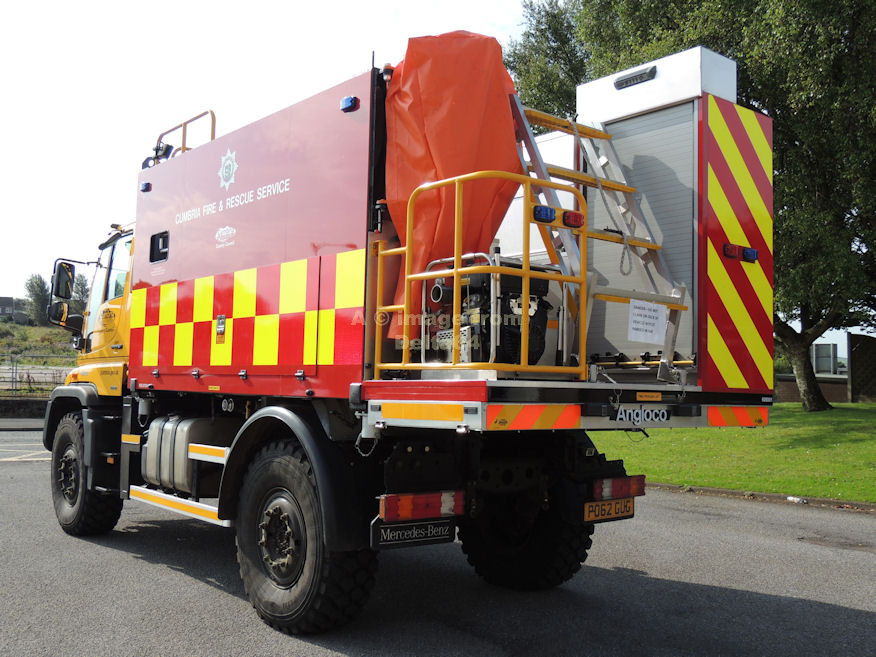
Where is `mirrors`? This screenshot has height=657, width=876. mirrors is located at coordinates (65, 283), (61, 315).